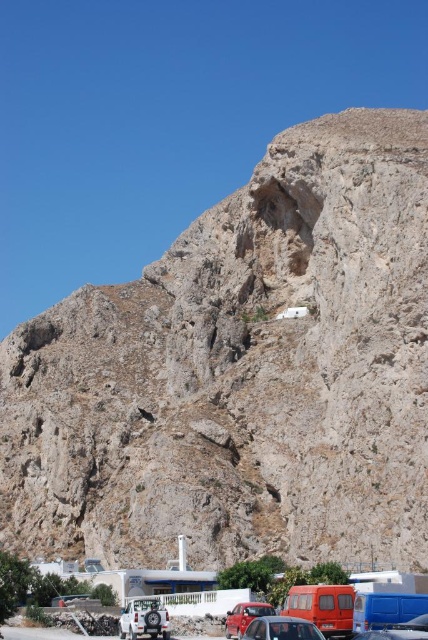
Looking at this image, you are a photographer planning to capture a landscape shot of the rugged stone mountain at upper center and the blue metallic van at lower right. Given that the mountain is wider than the van, how should you adjust your camera framing to ensure both are fully visible in the photo?

Since the rugged stone mountain at upper center is wider than the blue metallic van at lower right, you should position the mountain centrally and widen the camera frame to accommodate its greater width while still including the van at the lower right corner.

You are standing at the base of the rugged stone mountain at upper center. Looking up, where would you see the mountain located in your field of view?

The rugged stone mountain at upper center is located at the point with coordinates (241, 372) in the 2D space of the image, which corresponds to the upper center position in the field of view.

You are a delivery driver who needs to park your vehicle in a narrow space between the metallic red car at lower center and the blue metallic van at lower right. The space is exactly 2 meters wide. Can your 1.8 meter wide truck fit between them?

The metallic red car at lower center might be wider than blue metallic van at lower right. Since the space is only 2 meters wide and your truck is 1.8 meters wide, there is a possibility that the space is sufficient if the combined width of the car and van is less than 2 meters. However, without exact measurements, it is uncertain whether the truck will fit.